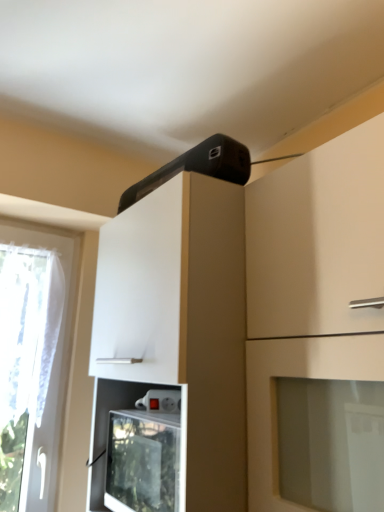
Describe the element at coordinates (197, 167) in the screenshot. The image size is (384, 512). I see `black plastic speaker at upper center` at that location.

Find the location of a particular element. white glossy cabinet at upper center, acting as the first cabinetry starting from the right is located at coordinates (317, 328).

Considering the sizes of objects white glossy cabinet at upper center, acting as the first cabinetry starting from the right, and white glossy cabinet at upper center, the second cabinetry positioned from the right, in the image provided, who is thinner, white glossy cabinet at upper center, acting as the first cabinetry starting from the right, or white glossy cabinet at upper center, the second cabinetry positioned from the right,?

white glossy cabinet at upper center, acting as the first cabinetry starting from the right.

Is point (368, 508) closer to viewer compared to point (232, 220)?

Yes, it is in front of point (232, 220).

Who is more distant, white glossy cabinet at upper center, the second cabinetry in the left-to-right sequence, or white glossy cabinet at upper center, the second cabinetry positioned from the right?

white glossy cabinet at upper center, the second cabinetry positioned from the right, is further from the camera.

What's the angular difference between white glossy cabinet at upper center, the second cabinetry in the left-to-right sequence, and white glossy cabinet at upper center, the first cabinetry positioned from the left,'s facing directions?

0.000751 degrees.

Considering the relative positions of black plastic speaker at upper center and white glossy cabinet at upper center, the first cabinetry positioned from the left, in the image provided, is black plastic speaker at upper center to the left of white glossy cabinet at upper center, the first cabinetry positioned from the left, from the viewer's perspective?

Correct, you'll find black plastic speaker at upper center to the left of white glossy cabinet at upper center, the first cabinetry positioned from the left.

Does black plastic speaker at upper center have a smaller size compared to white glossy cabinet at upper center, the second cabinetry positioned from the right?

Yes.

Would you consider black plastic speaker at upper center to be distant from white glossy cabinet at upper center, the first cabinetry positioned from the left?

black plastic speaker at upper center is actually quite close to white glossy cabinet at upper center, the first cabinetry positioned from the left.

From their relative heights in the image, would you say black plastic speaker at upper center is taller or shorter than white glossy cabinet at upper center, the second cabinetry positioned from the right?

Considering their sizes, black plastic speaker at upper center has less height than white glossy cabinet at upper center, the second cabinetry positioned from the right.

From a real-world perspective, is white glossy cabinet at upper center, acting as the first cabinetry starting from the right, physically located above or below black plastic speaker at upper center?

white glossy cabinet at upper center, acting as the first cabinetry starting from the right, is below black plastic speaker at upper center.

Which object is closer to the camera taking this photo, white glossy cabinet at upper center, acting as the first cabinetry starting from the right, or black plastic speaker at upper center?

white glossy cabinet at upper center, acting as the first cabinetry starting from the right, is closer to the camera.

Can you confirm if white glossy cabinet at upper center, the second cabinetry in the left-to-right sequence, is thinner than black plastic speaker at upper center?

No, white glossy cabinet at upper center, the second cabinetry in the left-to-right sequence, is not thinner than black plastic speaker at upper center.

From the image's perspective, is white glossy cabinet at upper center, acting as the first cabinetry starting from the right, on black plastic speaker at upper center?

Actually, white glossy cabinet at upper center, acting as the first cabinetry starting from the right, appears below black plastic speaker at upper center in the image.

Locate an element on the screen. cabinetry on the right of white glossy cabinet at upper center, the second cabinetry positioned from the right is located at coordinates (317, 328).

Is white glossy cabinet at upper center, the first cabinetry positioned from the left, spatially inside white glossy cabinet at upper center, acting as the first cabinetry starting from the right, or outside of it?

white glossy cabinet at upper center, the first cabinetry positioned from the left, is located beyond the bounds of white glossy cabinet at upper center, acting as the first cabinetry starting from the right.

Who is smaller, white glossy cabinet at upper center, the first cabinetry positioned from the left, or white glossy cabinet at upper center, acting as the first cabinetry starting from the right?

With smaller size is white glossy cabinet at upper center, acting as the first cabinetry starting from the right.

Considering the relative positions of black plastic speaker at upper center and white glossy cabinet at upper center, acting as the first cabinetry starting from the right, in the image provided, is black plastic speaker at upper center to the left of white glossy cabinet at upper center, acting as the first cabinetry starting from the right, from the viewer's perspective?

Correct, you'll find black plastic speaker at upper center to the left of white glossy cabinet at upper center, acting as the first cabinetry starting from the right.

Who is bigger, black plastic speaker at upper center or white glossy cabinet at upper center, the second cabinetry in the left-to-right sequence?

Bigger between the two is white glossy cabinet at upper center, the second cabinetry in the left-to-right sequence.

From the picture: Would you consider black plastic speaker at upper center to be distant from white glossy cabinet at upper center, acting as the first cabinetry starting from the right?

No, black plastic speaker at upper center is not far from white glossy cabinet at upper center, acting as the first cabinetry starting from the right.

How much distance is there between white glossy cabinet at upper center, the second cabinetry positioned from the right, and black plastic speaker at upper center?

10.28 inches.

Which of these two, white glossy cabinet at upper center, the first cabinetry positioned from the left, or black plastic speaker at upper center, stands taller?

white glossy cabinet at upper center, the first cabinetry positioned from the left.

Where is `the 1st cabinetry to the right of the black plastic speaker at upper center, starting your count from the anchor`? Image resolution: width=384 pixels, height=512 pixels. the 1st cabinetry to the right of the black plastic speaker at upper center, starting your count from the anchor is located at coordinates (179, 324).

Between point (138, 260) and point (222, 157), which one is positioned in front?

The point (222, 157) is closer.

This screenshot has height=512, width=384. I want to click on cabinetry lying on the right of white glossy cabinet at upper center, the first cabinetry positioned from the left, so click(317, 328).

Identify the location of appliance to the left of white glossy cabinet at upper center, the first cabinetry positioned from the left. (197, 167).

Looking at the image, which one is located further to white glossy cabinet at upper center, the second cabinetry positioned from the right, black plastic speaker at upper center or white glossy cabinet at upper center, the second cabinetry in the left-to-right sequence?

black plastic speaker at upper center.

Which object lies further to the anchor point white glossy cabinet at upper center, the second cabinetry in the left-to-right sequence, white glossy cabinet at upper center, the first cabinetry positioned from the left, or black plastic speaker at upper center?

black plastic speaker at upper center lies further to white glossy cabinet at upper center, the second cabinetry in the left-to-right sequence, than the other object.

From the image, which object appears to be nearer to black plastic speaker at upper center, white glossy cabinet at upper center, the second cabinetry in the left-to-right sequence, or white glossy cabinet at upper center, the second cabinetry positioned from the right?

white glossy cabinet at upper center, the second cabinetry positioned from the right, is positioned closer to the anchor black plastic speaker at upper center.

Estimate the real-world distances between objects in this image. Which object is closer to black plastic speaker at upper center, white glossy cabinet at upper center, the first cabinetry positioned from the left, or white glossy cabinet at upper center, the second cabinetry in the left-to-right sequence?

white glossy cabinet at upper center, the first cabinetry positioned from the left, is closer to black plastic speaker at upper center.

Which object lies further to the anchor point white glossy cabinet at upper center, the second cabinetry positioned from the right, white glossy cabinet at upper center, the second cabinetry in the left-to-right sequence, or black plastic speaker at upper center?

Among the two, black plastic speaker at upper center is located further to white glossy cabinet at upper center, the second cabinetry positioned from the right.

From the image, which object appears to be nearer to white glossy cabinet at upper center, the second cabinetry in the left-to-right sequence, black plastic speaker at upper center or white glossy cabinet at upper center, the first cabinetry positioned from the left?

white glossy cabinet at upper center, the first cabinetry positioned from the left, lies closer to white glossy cabinet at upper center, the second cabinetry in the left-to-right sequence, than the other object.

In order to click on cabinetry between black plastic speaker at upper center and white glossy cabinet at upper center, the second cabinetry positioned from the right, in the vertical direction in this screenshot , I will do `click(317, 328)`.